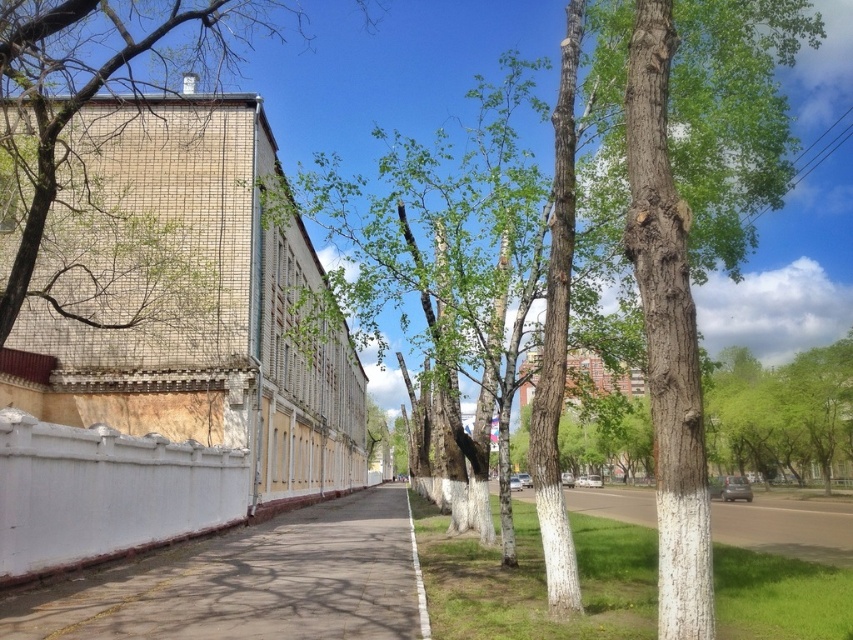
What do you see at coordinates (91, 84) in the screenshot?
I see `green leafy tree at upper left` at bounding box center [91, 84].

Measure the distance from green leafy tree at upper left to green grass at lower center.

green leafy tree at upper left and green grass at lower center are 23.32 meters apart from each other.

You are a GUI agent. You are given a task and a screenshot of the screen. Output one action in this format:
    pyautogui.click(x=<x>, y=<y>)
    Task: Click on the green leafy tree at upper left
    The image size is (853, 640).
    Given the screenshot: What is the action you would take?
    pyautogui.click(x=91, y=84)

Image resolution: width=853 pixels, height=640 pixels. Describe the element at coordinates (248, 582) in the screenshot. I see `white concrete pavement at center` at that location.

Who is more distant from viewer, (x=332, y=500) or (x=77, y=483)?

Point (x=332, y=500)

Where is `white concrete pavement at center`? The height and width of the screenshot is (640, 853). white concrete pavement at center is located at coordinates (248, 582).

Locate an element on the screen. Image resolution: width=853 pixels, height=640 pixels. white concrete pavement at center is located at coordinates (248, 582).

Between white concrete pavement at center and green leafy tree at upper left, which one is positioned higher?

Positioned higher is green leafy tree at upper left.

Between point (393, 557) and point (189, 33), which one is positioned in front?

Point (393, 557)

In order to click on white concrete pavement at center in this screenshot , I will do `click(248, 582)`.